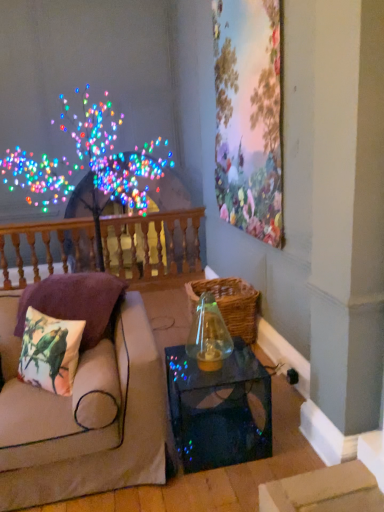
Question: Considering the relative sizes of transparent glass vase at center and transparent glass table at lower center in the image provided, is transparent glass vase at center bigger than transparent glass table at lower center?

Choices:
 (A) yes
 (B) no

Answer: (B)

Question: Is transparent glass vase at center at the left side of transparent glass table at lower center?

Choices:
 (A) yes
 (B) no

Answer: (A)

Question: Is transparent glass vase at center touching transparent glass table at lower center?

Choices:
 (A) no
 (B) yes

Answer: (A)

Question: Does transparent glass vase at center have a smaller size compared to transparent glass table at lower center?

Choices:
 (A) yes
 (B) no

Answer: (A)

Question: Considering the relative sizes of transparent glass vase at center and transparent glass table at lower center in the image provided, is transparent glass vase at center wider than transparent glass table at lower center?

Choices:
 (A) no
 (B) yes

Answer: (A)

Question: From the image's perspective, is transparent glass vase at center below transparent glass table at lower center?

Choices:
 (A) no
 (B) yes

Answer: (A)

Question: Considering the relative positions of woven brown basket at center and transparent glass table at lower center in the image provided, is woven brown basket at center behind transparent glass table at lower center?

Choices:
 (A) no
 (B) yes

Answer: (B)

Question: Is woven brown basket at center at the left side of transparent glass table at lower center?

Choices:
 (A) yes
 (B) no

Answer: (B)

Question: Would you consider woven brown basket at center to be distant from transparent glass table at lower center?

Choices:
 (A) no
 (B) yes

Answer: (A)

Question: From the image's perspective, is woven brown basket at center located beneath transparent glass table at lower center?

Choices:
 (A) no
 (B) yes

Answer: (A)

Question: Is transparent glass table at lower center at the back of woven brown basket at center?

Choices:
 (A) yes
 (B) no

Answer: (B)

Question: Is woven brown basket at center to the right of transparent glass table at lower center from the viewer's perspective?

Choices:
 (A) no
 (B) yes

Answer: (B)

Question: Does printed fabric cushion at left, placed as the 1th pillow when sorted from back to front, have a lesser width compared to wooden balustrade at upper left?

Choices:
 (A) no
 (B) yes

Answer: (A)